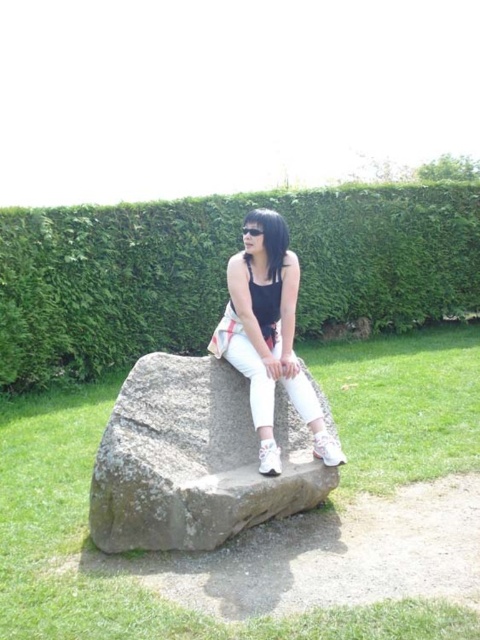
Is gray rough stone at center thinner than transparent plastic goggles at center?

In fact, gray rough stone at center might be wider than transparent plastic goggles at center.

Is gray rough stone at center bigger than transparent plastic goggles at center?

Indeed, gray rough stone at center has a larger size compared to transparent plastic goggles at center.

Is point (182, 419) positioned in front of point (252, 236)?

Yes, it is.

Identify the location of gray rough stone at center. (193, 460).

Can you confirm if gray rough stone at center is shorter than matte black tank top at center?

Yes, gray rough stone at center is shorter than matte black tank top at center.

Can you confirm if gray rough stone at center is positioned to the right of matte black tank top at center?

Incorrect, gray rough stone at center is not on the right side of matte black tank top at center.

The height and width of the screenshot is (640, 480). What do you see at coordinates (193, 460) in the screenshot?
I see `gray rough stone at center` at bounding box center [193, 460].

Locate an element on the screen. gray rough stone at center is located at coordinates (193, 460).

Is point (178, 292) positioned after point (252, 369)?

Yes, it is.

Does green leafy hedge at upper center appear on the right side of matte black tank top at center?

No, green leafy hedge at upper center is not to the right of matte black tank top at center.

Find the location of a particular element. The width and height of the screenshot is (480, 640). green leafy hedge at upper center is located at coordinates (223, 272).